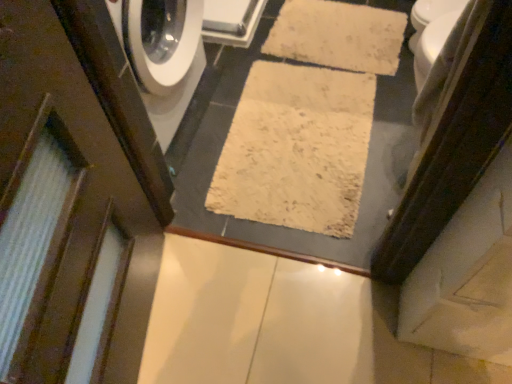
Measure the distance between beige textured bath mat at center and camera.

beige textured bath mat at center is 4.85 feet away from camera.

The height and width of the screenshot is (384, 512). In order to click on beige textured bath mat at center in this screenshot , I will do `click(296, 149)`.

This screenshot has width=512, height=384. What do you see at coordinates (296, 149) in the screenshot?
I see `beige textured bath mat at center` at bounding box center [296, 149].

Identify the location of beige textured bath mat at center. The width and height of the screenshot is (512, 384). click(296, 149).